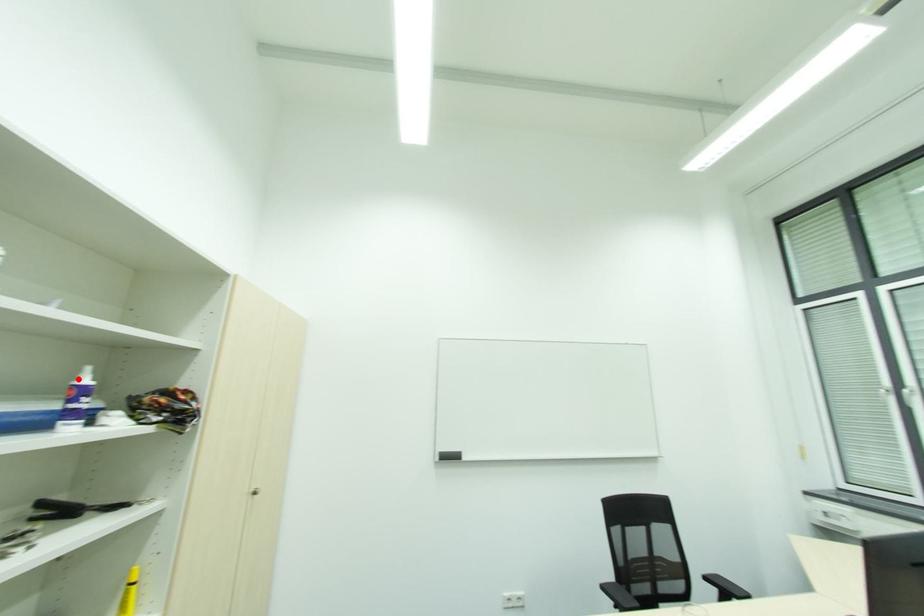
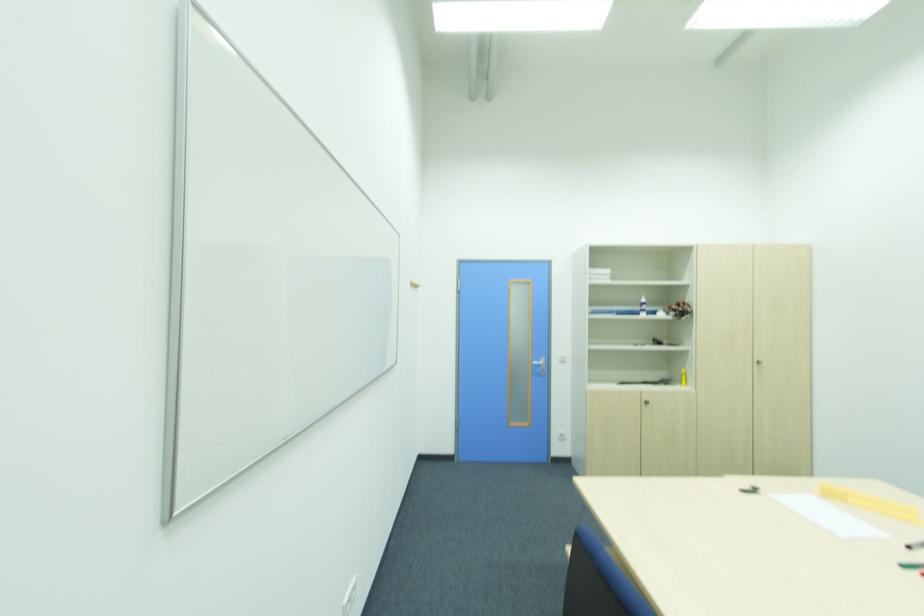
The point at the highlighted location is marked in the first image. Where is the corresponding point in the second image?

(643, 301)